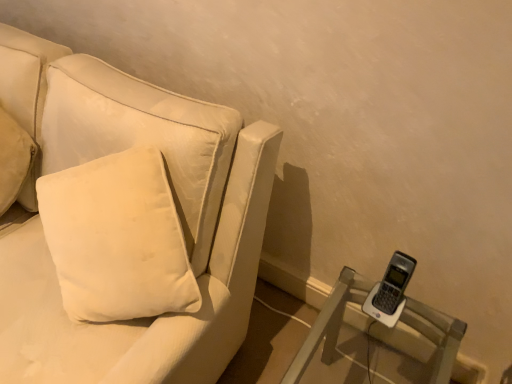
Question: Would you say velvet white couch at left is outside white soft cushion at left?

Choices:
 (A) yes
 (B) no

Answer: (A)

Question: Does velvet white couch at left appear on the right side of white soft cushion at left?

Choices:
 (A) yes
 (B) no

Answer: (B)

Question: Considering the relative sizes of velvet white couch at left and white soft cushion at left in the image provided, is velvet white couch at left bigger than white soft cushion at left?

Choices:
 (A) no
 (B) yes

Answer: (B)

Question: From the image's perspective, is velvet white couch at left under white soft cushion at left?

Choices:
 (A) no
 (B) yes

Answer: (B)

Question: Is velvet white couch at left aimed at white soft cushion at left?

Choices:
 (A) yes
 (B) no

Answer: (A)

Question: Would you say clear plastic phone at lower right is to the left or to the right of white soft cushion at left in the picture?

Choices:
 (A) right
 (B) left

Answer: (A)

Question: Is clear plastic phone at lower right inside the boundaries of white soft cushion at left, or outside?

Choices:
 (A) outside
 (B) inside

Answer: (A)

Question: In terms of width, does clear plastic phone at lower right look wider or thinner when compared to white soft cushion at left?

Choices:
 (A) thin
 (B) wide

Answer: (B)

Question: Considering the positions of clear plastic phone at lower right and white soft cushion at left in the image, is clear plastic phone at lower right taller or shorter than white soft cushion at left?

Choices:
 (A) short
 (B) tall

Answer: (A)

Question: Looking at their shapes, would you say white soft cushion at left is wider or thinner than clear plastic phone at lower right?

Choices:
 (A) thin
 (B) wide

Answer: (A)

Question: Visually, is white soft cushion at left positioned to the left or to the right of clear plastic phone at lower right?

Choices:
 (A) left
 (B) right

Answer: (A)

Question: Is white soft cushion at left taller or shorter than clear plastic phone at lower right?

Choices:
 (A) short
 (B) tall

Answer: (B)

Question: Does point (18, 195) appear closer or farther from the camera than point (337, 322)?

Choices:
 (A) closer
 (B) farther

Answer: (A)

Question: From the image's perspective, is velvet white couch at left located above or below white soft cushion at left?

Choices:
 (A) above
 (B) below

Answer: (B)

Question: In terms of height, does velvet white couch at left look taller or shorter compared to white soft cushion at left?

Choices:
 (A) short
 (B) tall

Answer: (B)